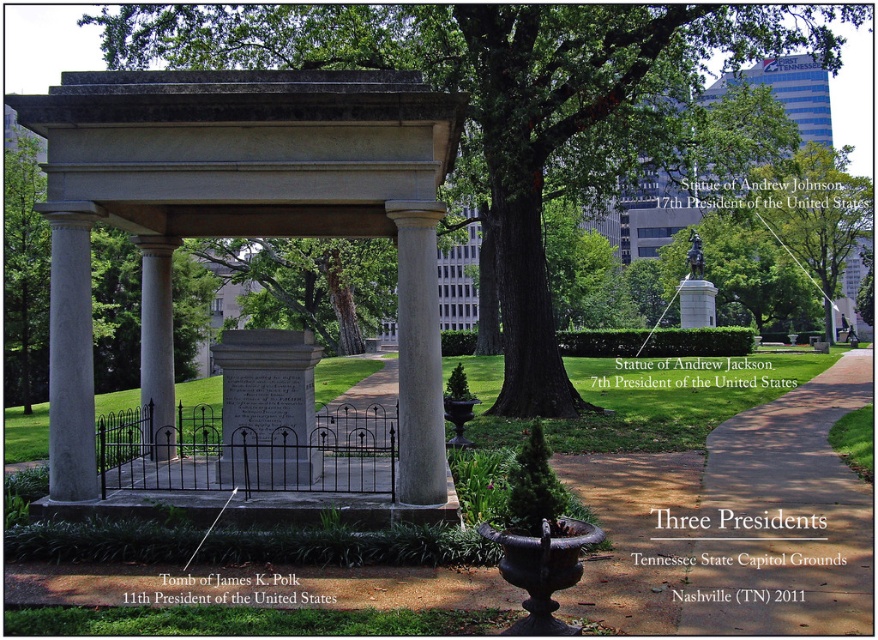
In order to click on white marble column at center in this screenshot , I will do `click(418, 355)`.

Is point (429, 212) positioned in front of point (77, 253)?

Yes, point (429, 212) is closer to viewer.

The height and width of the screenshot is (640, 878). I want to click on white marble column at center, so click(418, 355).

Does green leafy tree at upper center appear under gray stone column at center?

Actually, green leafy tree at upper center is above gray stone column at center.

The width and height of the screenshot is (878, 640). Describe the element at coordinates (814, 212) in the screenshot. I see `green leafy tree at upper center` at that location.

Is point (751, 173) in front of point (171, 326)?

No.

You are a GUI agent. You are given a task and a screenshot of the screen. Output one action in this format:
    pyautogui.click(x=<x>, y=<y>)
    Task: Click on the green leafy tree at upper center
    
    Given the screenshot: What is the action you would take?
    pyautogui.click(x=814, y=212)

Which is in front, point (77, 312) or point (802, 189)?

Point (77, 312) is in front.

Is point (62, 372) closer to viewer compared to point (824, 193)?

Yes, point (62, 372) is closer to viewer.

Measure the distance between white marble column at left and camera.

white marble column at left is 24.88 feet away from camera.

At what (x,y) coordinates should I click in order to perform the action: click on white marble column at left. Please return your answer as a coordinate pair (x, y). Looking at the image, I should click on (70, 360).